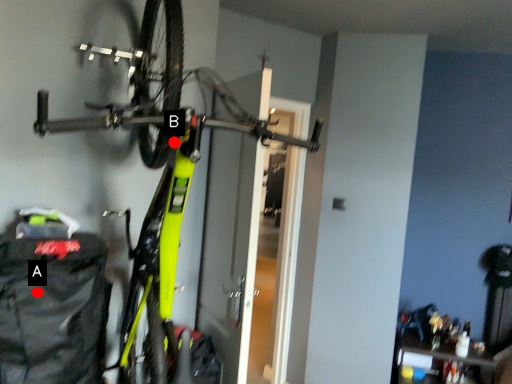
Question: Two points are circled on the image, labeled by A and B beside each circle. Which point is closer to the camera?

Choices:
 (A) A is closer
 (B) B is closer

Answer: (B)